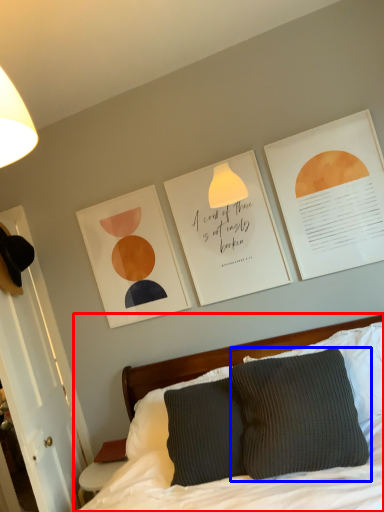
Question: Which of the following is the closest to the observer, bed (highlighted by a red box) or pillow (highlighted by a blue box)?

Choices:
 (A) bed
 (B) pillow

Answer: (A)